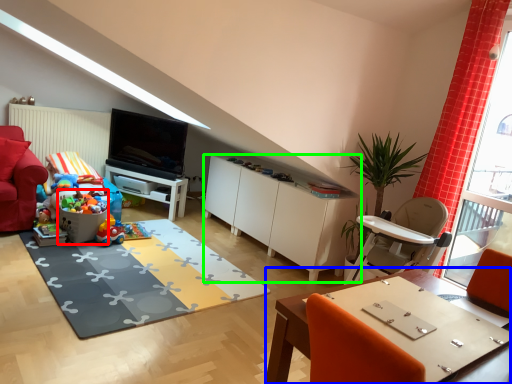
Question: Based on their relative distances, which object is farther from toy (highlighted by a red box)? Choose from table (highlighted by a blue box) and cabinetry (highlighted by a green box).

Choices:
 (A) table
 (B) cabinetry

Answer: (A)